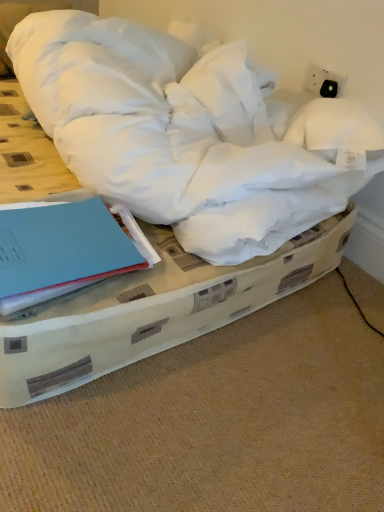
Question: Would you say white soft bed at center is inside or outside blue matte book at lower left?

Choices:
 (A) inside
 (B) outside

Answer: (B)

Question: From a real-world perspective, is white soft bed at center positioned above or below blue matte book at lower left?

Choices:
 (A) below
 (B) above

Answer: (A)

Question: Looking at their shapes, would you say white soft bed at center is wider or thinner than blue matte book at lower left?

Choices:
 (A) thin
 (B) wide

Answer: (B)

Question: In terms of height, does blue matte book at lower left look taller or shorter compared to white soft bed at center?

Choices:
 (A) short
 (B) tall

Answer: (B)

Question: Is blue matte book at lower left in front of or behind white soft bed at center in the image?

Choices:
 (A) front
 (B) behind

Answer: (B)

Question: Is point (44, 284) positioned closer to the camera than point (200, 308)?

Choices:
 (A) closer
 (B) farther

Answer: (A)

Question: From a real-world perspective, is blue matte book at lower left physically located above or below white soft bed at center?

Choices:
 (A) above
 (B) below

Answer: (A)